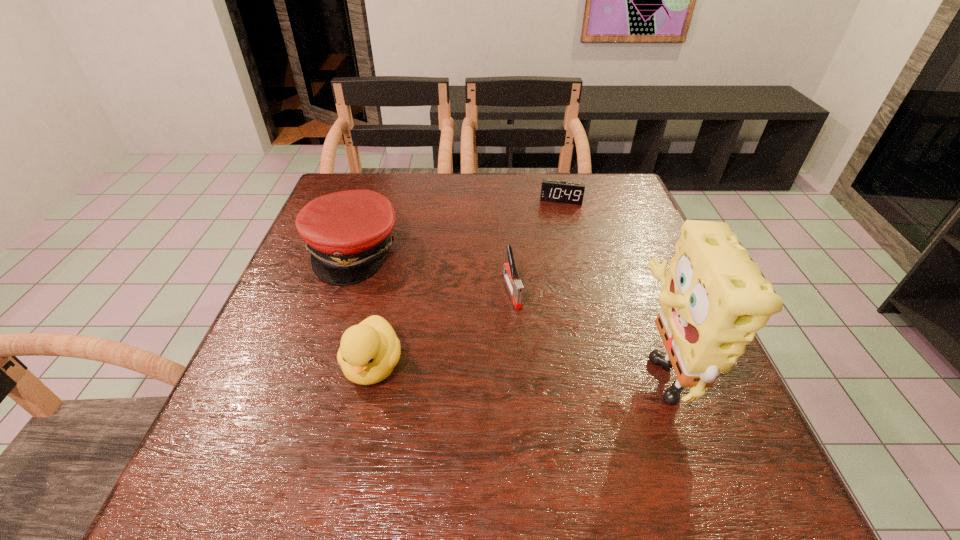
Identify the location of free space located 0.290m on the handle side of the third object from left to right. The width and height of the screenshot is (960, 540). (564, 429).

Image resolution: width=960 pixels, height=540 pixels. Find the location of `free space located 0.070m on the handle side of the third object from left to right`. free space located 0.070m on the handle side of the third object from left to right is located at coordinates (525, 333).

At what (x,y) coordinates should I click in order to perform the action: click on vacant area situated on the handle side of the third object from left to right. Please return your answer as a coordinate pair (x, y). The width and height of the screenshot is (960, 540). Looking at the image, I should click on (525, 333).

Locate an element on the screen. The image size is (960, 540). vacant area situated on the front-facing side of the cap is located at coordinates (402, 287).

You are a GUI agent. You are given a task and a screenshot of the screen. Output one action in this format:
    pyautogui.click(x=<x>, y=<y>)
    Task: Click on the free space located 0.390m on the front-facing side of the cap
    The image size is (960, 540).
    Given the screenshot: What is the action you would take?
    pyautogui.click(x=513, y=361)

Find the location of a particular element. blank space located 0.360m on the front-facing side of the cap is located at coordinates (501, 353).

Identify the location of vacant area located on the front-facing side of the alarm clock. (553, 238).

What are the coordinates of `vacant space located 0.180m on the front-facing side of the alarm clock` in the screenshot? It's located at (553, 243).

Identify the location of vacant region located on the front-facing side of the alarm clock. (x=552, y=245).

In order to click on object that is at the far edge in this screenshot , I will do `click(557, 191)`.